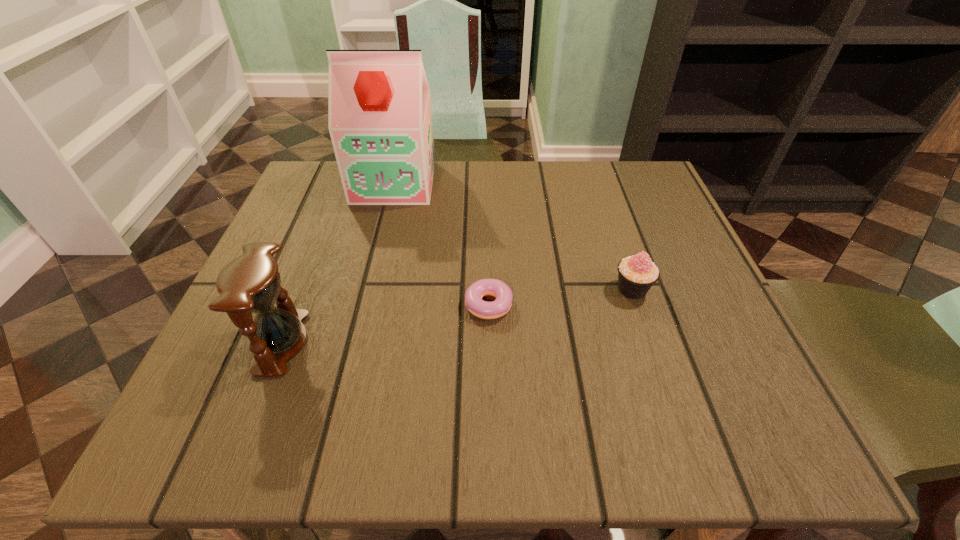
You are a GUI agent. You are given a task and a screenshot of the screen. Output one action in this format:
    pyautogui.click(x=<x>, y=<y>)
    Task: Click on the soya milk
    This screenshot has width=960, height=540.
    Given the screenshot: What is the action you would take?
    pyautogui.click(x=379, y=117)

This screenshot has width=960, height=540. I want to click on the tallest object, so click(379, 117).

This screenshot has height=540, width=960. Identify the location of hourglass. (251, 283).

Identify the location of the third tallest object. This screenshot has height=540, width=960. (636, 274).

The image size is (960, 540). Identify the location of the rightmost object. (636, 274).

This screenshot has height=540, width=960. Find the location of `the third object from left to right`. the third object from left to right is located at coordinates (501, 305).

What are the coordinates of `doughnut` in the screenshot? It's located at (501, 305).

What are the coordinates of `vacant space positioned with the cap open on the soya milk` in the screenshot? It's located at (368, 291).

Where is `free space located on the back of the third shortest object`? free space located on the back of the third shortest object is located at coordinates (330, 219).

Find the location of a particular element. vacant space located 0.290m on the left of the cupcake is located at coordinates (451, 289).